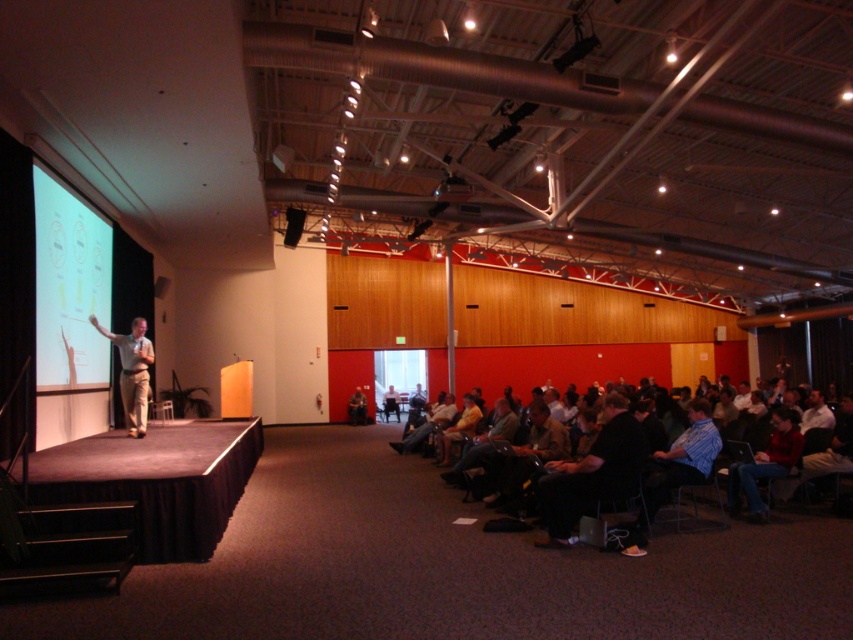
Question: Does matte white projection screen at left have a lesser width compared to light brown casual wear at stage left?

Choices:
 (A) no
 (B) yes

Answer: (B)

Question: Is dark brown leather chairs at lower center smaller than matte white projection screen at left?

Choices:
 (A) yes
 (B) no

Answer: (A)

Question: Which point is farther from the camera taking this photo?

Choices:
 (A) (125, 417)
 (B) (648, 477)
 (C) (73, 214)

Answer: (A)

Question: Can you confirm if matte white projection screen at left is thinner than light brown casual wear at stage left?

Choices:
 (A) yes
 (B) no

Answer: (A)

Question: Which of these objects is positioned farthest from the matte white projection screen at left?

Choices:
 (A) dark brown leather chairs at lower center
 (B) light brown casual wear at stage left

Answer: (A)

Question: Which object is the farthest from the light brown casual wear at stage left?

Choices:
 (A) dark brown leather chairs at lower center
 (B) matte white projection screen at left

Answer: (A)